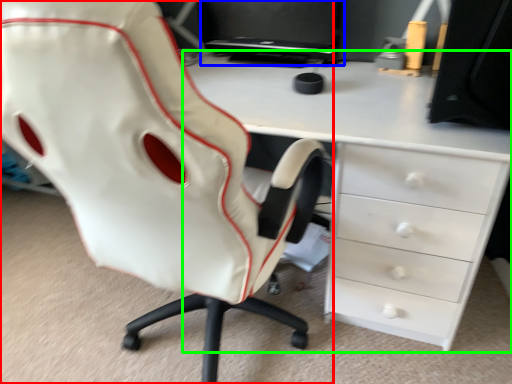
Question: Based on their relative distances, which object is nearer to chair (highlighted by a red box)? Choose from computer monitor (highlighted by a blue box) and desk (highlighted by a green box).

Choices:
 (A) computer monitor
 (B) desk

Answer: (B)